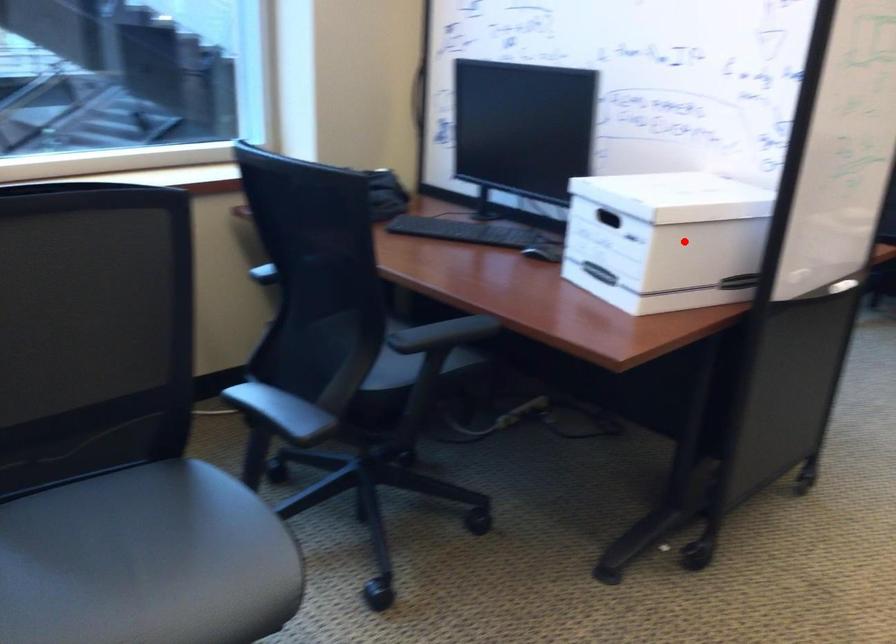
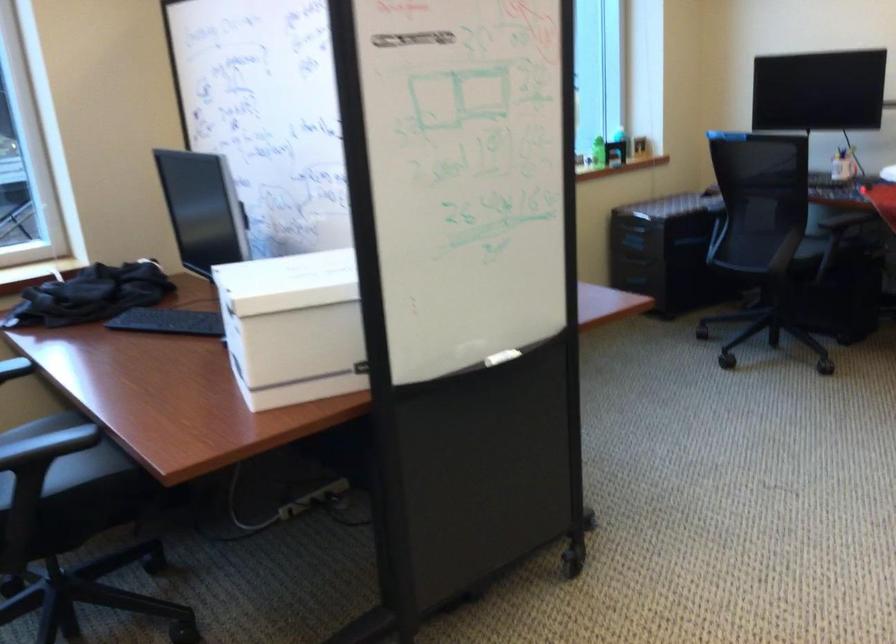
Where in the second image is the point corresponding to the highlighted location from the first image?

(293, 327)